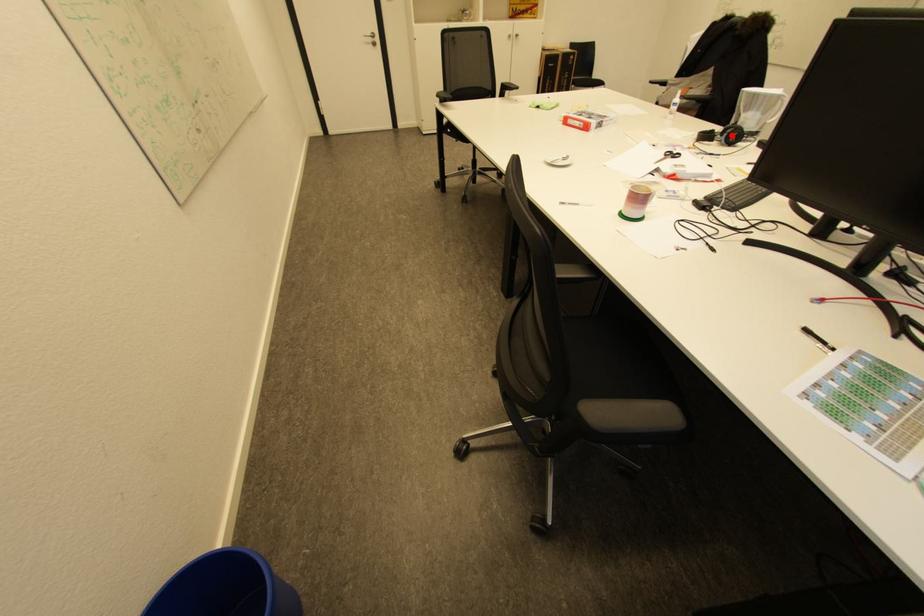
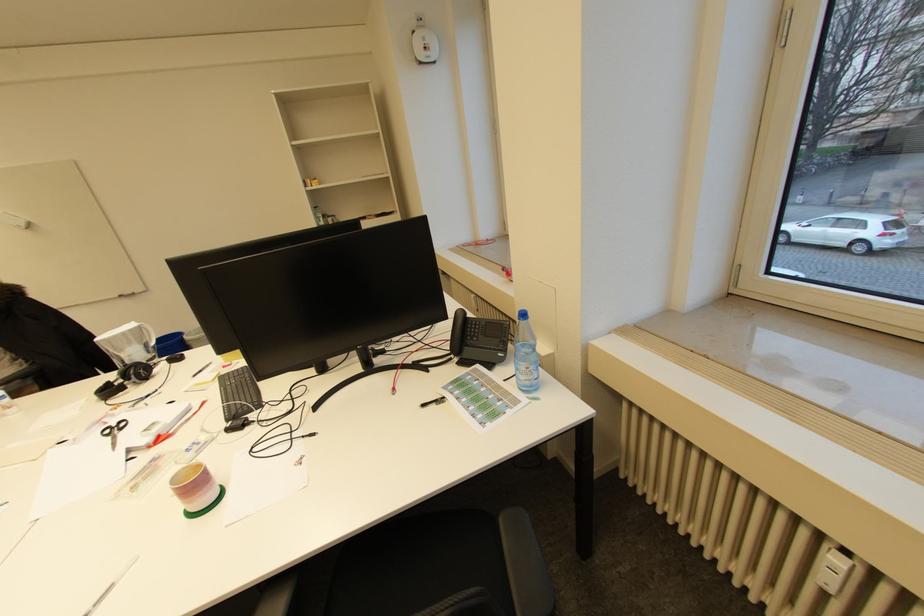
Find the pixel in the second image that matches the highlighted location in the first image.

(140, 377)